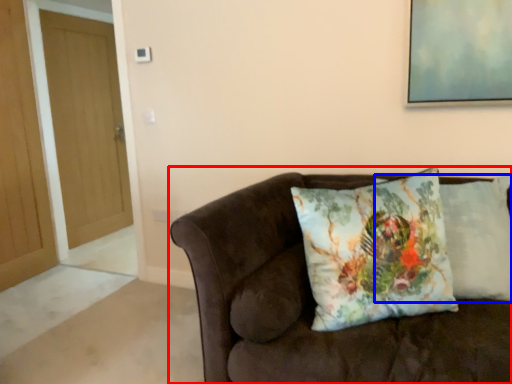
Question: Among these objects, which one is farthest to the camera, studio couch (highlighted by a red box) or pillow (highlighted by a blue box)?

Choices:
 (A) studio couch
 (B) pillow

Answer: (B)